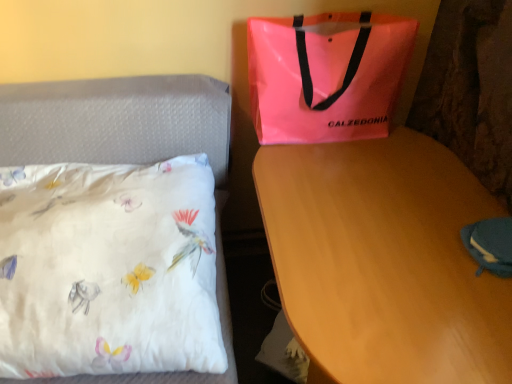
Locate an element on the screen. free point behind blue fabric pouch at lower right is located at coordinates (457, 198).